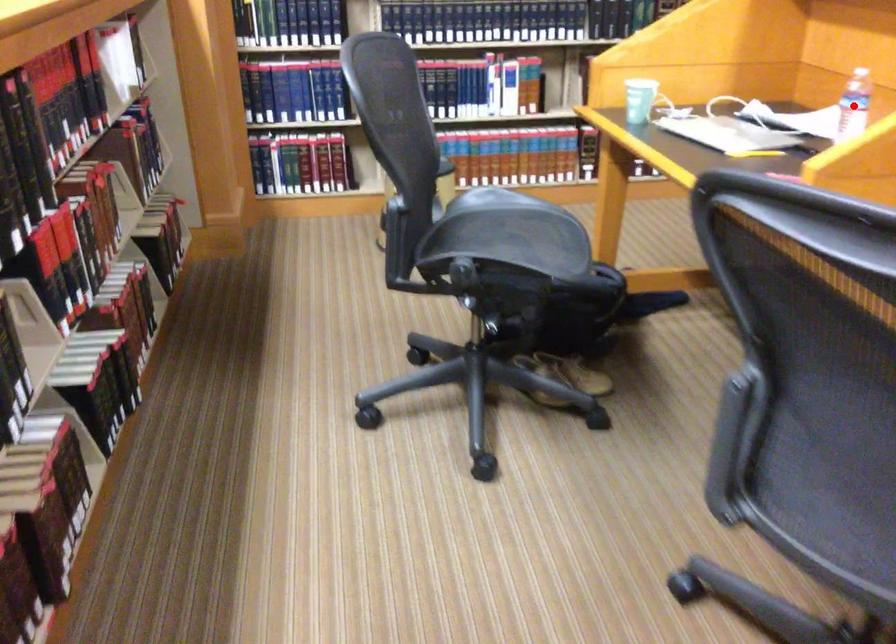
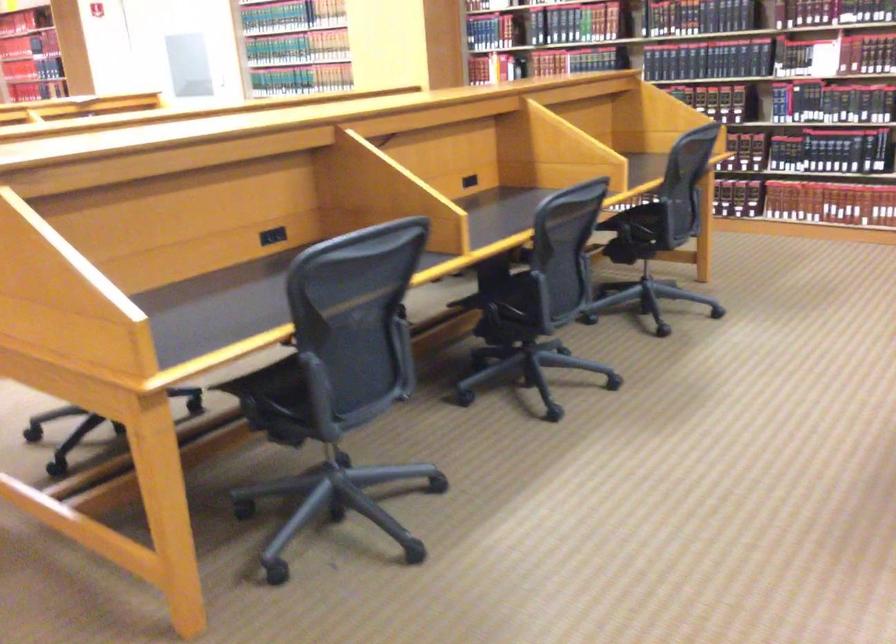
Question: I am providing you with two images of the same scene from different viewpoints. A red point is marked on the first image. Can you still see the location of the red point in image 2?

Choices:
 (A) Yes
 (B) No

Answer: (B)